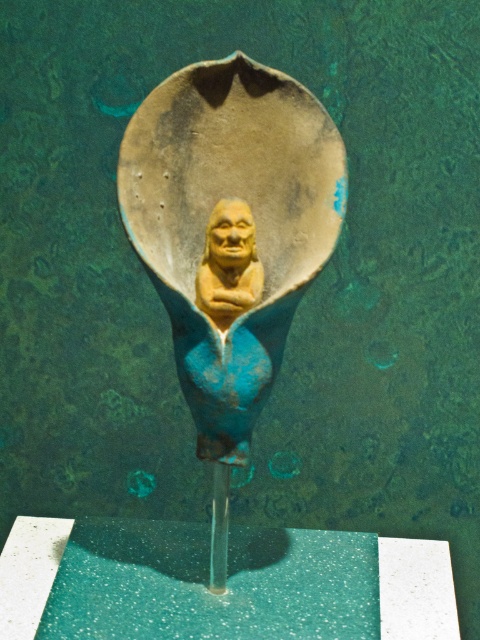
You are an archaeologist examining the artifact displayed on the pedestal. You notice a point marked at coordinates (229, 236). What does this point correspond to on the artifact?

The point at coordinates (229, 236) corresponds to the matte yellow figure at center.

Looking at this image, you are an art conservator tasked with ensuring the safety of the matte yellow figure at center and the matte yellow bust at center displayed on the pedestal. Given that the minimum safe distance between two artifacts for proper preservation is 8 centimeters, is the current spacing between them sufficient?

The matte yellow figure at center is 7.77 centimeters away from the matte yellow bust at center. Since the minimum safe distance required is 8 centimeters, the current spacing is insufficient for proper preservation.